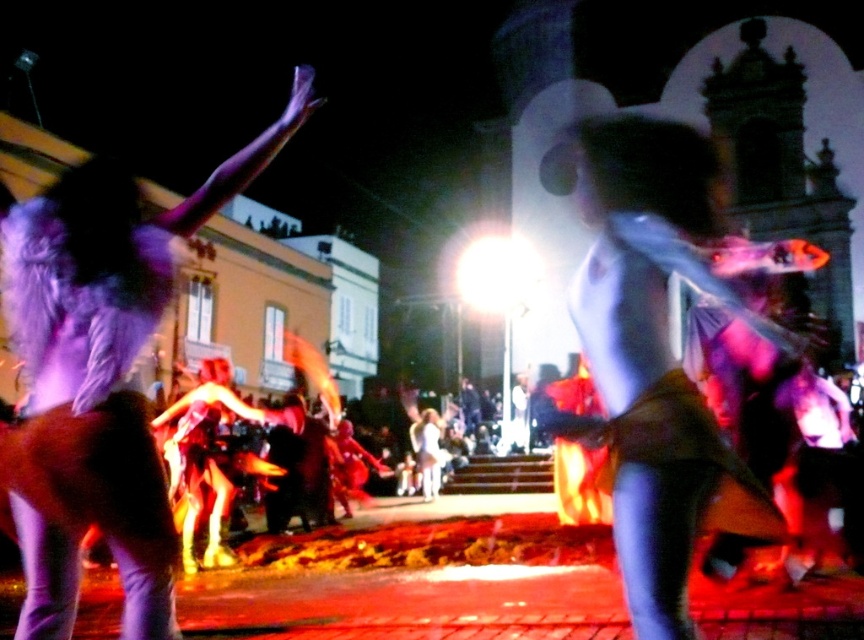
Question: From the image, what is the correct spatial relationship of matte white dress at center in relation to purple feathered wings at upper left?

Choices:
 (A) left
 (B) right

Answer: (B)

Question: Can you confirm if matte white dress at center is smaller than purple feathered wings at upper left?

Choices:
 (A) yes
 (B) no

Answer: (A)

Question: Is matte white dress at center further to the viewer compared to purple feathered wings at upper left?

Choices:
 (A) yes
 (B) no

Answer: (B)

Question: Among these points, which one is nearest to the camera?

Choices:
 (A) (89, 330)
 (B) (664, 563)

Answer: (B)